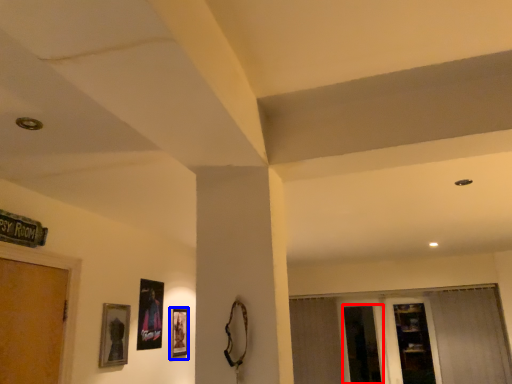
Question: Which object appears closest to the camera in this image, screen door (highlighted by a red box) or picture frame (highlighted by a blue box)?

Choices:
 (A) screen door
 (B) picture frame

Answer: (B)